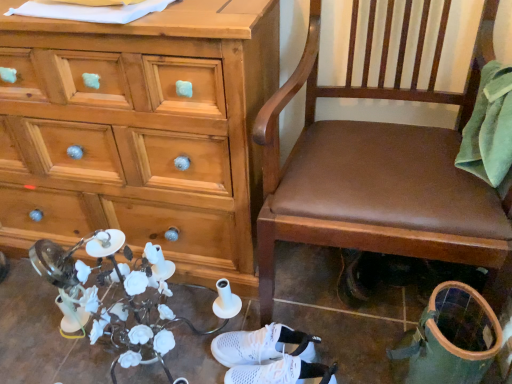
Question: Can you confirm if brown leather chair at center is positioned to the right of wooden chest of drawers at left?

Choices:
 (A) yes
 (B) no

Answer: (A)

Question: Is brown leather chair at center located outside wooden chest of drawers at left?

Choices:
 (A) no
 (B) yes

Answer: (B)

Question: Does brown leather chair at center turn towards wooden chest of drawers at left?

Choices:
 (A) yes
 (B) no

Answer: (B)

Question: Considering the relative sizes of brown leather chair at center and wooden chest of drawers at left in the image provided, is brown leather chair at center smaller than wooden chest of drawers at left?

Choices:
 (A) no
 (B) yes

Answer: (B)

Question: Would you say brown leather chair at center is a long distance from wooden chest of drawers at left?

Choices:
 (A) no
 (B) yes

Answer: (A)

Question: Does brown leather chair at center have a lesser width compared to wooden chest of drawers at left?

Choices:
 (A) no
 (B) yes

Answer: (A)

Question: From the image's perspective, would you say wooden chest of drawers at left is positioned over white mesh sneakers at lower center, marked as the 1th footwear in a front-to-back arrangement?

Choices:
 (A) no
 (B) yes

Answer: (B)

Question: Is wooden chest of drawers at left closer to the viewer compared to white mesh sneakers at lower center, the 2th footwear in the back-to-front sequence?

Choices:
 (A) no
 (B) yes

Answer: (B)

Question: Is wooden chest of drawers at left not inside white mesh sneakers at lower center, the 2th footwear in the back-to-front sequence?

Choices:
 (A) yes
 (B) no

Answer: (A)

Question: Is wooden chest of drawers at left to the right of white mesh sneakers at lower center, the 2th footwear in the back-to-front sequence, from the viewer's perspective?

Choices:
 (A) no
 (B) yes

Answer: (A)

Question: Does wooden chest of drawers at left have a lesser height compared to white mesh sneakers at lower center, marked as the 1th footwear in a front-to-back arrangement?

Choices:
 (A) yes
 (B) no

Answer: (B)

Question: Considering the relative sizes of wooden chest of drawers at left and white mesh sneakers at lower center, the 2th footwear in the back-to-front sequence, in the image provided, is wooden chest of drawers at left thinner than white mesh sneakers at lower center, the 2th footwear in the back-to-front sequence,?

Choices:
 (A) yes
 (B) no

Answer: (B)

Question: Considering the relative sizes of wooden chest of drawers at left and brown leather chair at center in the image provided, is wooden chest of drawers at left wider than brown leather chair at center?

Choices:
 (A) yes
 (B) no

Answer: (B)